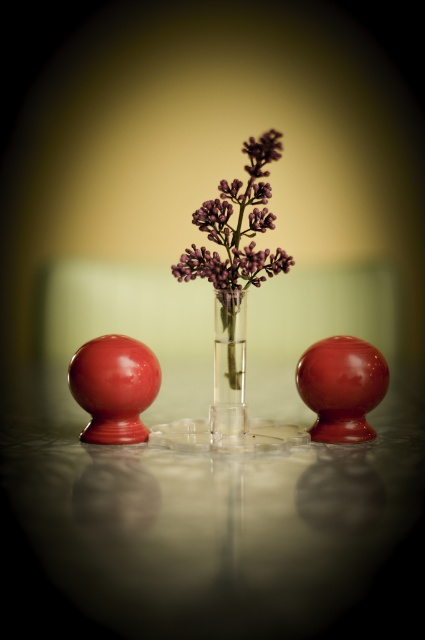
You are a photographer adjusting the focus on your camera. You want to ensure both the transparent glass table at center and the clear glass vase at center are in sharp focus. Which object should you focus on first to achieve this?

You should focus on the transparent glass table at center first since it is closer to the viewer than the clear glass vase at center. By focusing on the closer object, the vase will also be in focus due to the depth of field.